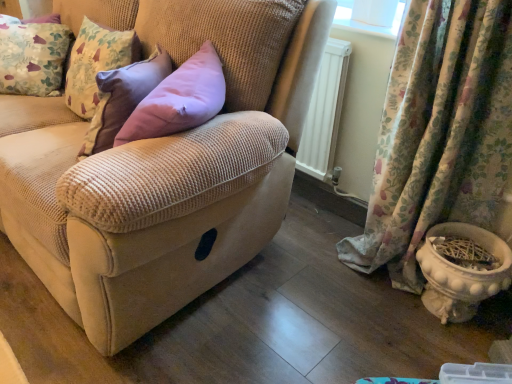
Question: From the image's perspective, is floral fabric cushion at upper left over white glossy flowerpot at lower right?

Choices:
 (A) yes
 (B) no

Answer: (A)

Question: Can we say floral fabric cushion at upper left lies outside white glossy flowerpot at lower right?

Choices:
 (A) yes
 (B) no

Answer: (A)

Question: Is floral fabric cushion at upper left at the left side of white glossy flowerpot at lower right?

Choices:
 (A) yes
 (B) no

Answer: (A)

Question: Considering the relative positions of floral fabric cushion at upper left and white glossy flowerpot at lower right in the image provided, is floral fabric cushion at upper left to the right of white glossy flowerpot at lower right from the viewer's perspective?

Choices:
 (A) no
 (B) yes

Answer: (A)

Question: Does floral fabric cushion at upper left have a larger size compared to white glossy flowerpot at lower right?

Choices:
 (A) no
 (B) yes

Answer: (B)

Question: Choose the correct answer: Is beige corduroy couch at center inside white glossy flowerpot at lower right or outside it?

Choices:
 (A) inside
 (B) outside

Answer: (B)

Question: Is beige corduroy couch at center bigger or smaller than white glossy flowerpot at lower right?

Choices:
 (A) small
 (B) big

Answer: (B)

Question: In the image, is beige corduroy couch at center on the left side or the right side of white glossy flowerpot at lower right?

Choices:
 (A) left
 (B) right

Answer: (A)

Question: Is beige corduroy couch at center in front of or behind white glossy flowerpot at lower right in the image?

Choices:
 (A) front
 (B) behind

Answer: (A)

Question: Is beige corduroy couch at center inside the boundaries of floral fabric curtain at lower right, or outside?

Choices:
 (A) outside
 (B) inside

Answer: (A)

Question: Relative to floral fabric curtain at lower right, is beige corduroy couch at center in front or behind?

Choices:
 (A) behind
 (B) front

Answer: (B)

Question: From the image's perspective, is beige corduroy couch at center positioned above or below floral fabric curtain at lower right?

Choices:
 (A) above
 (B) below

Answer: (A)

Question: In terms of width, does beige corduroy couch at center look wider or thinner when compared to floral fabric curtain at lower right?

Choices:
 (A) thin
 (B) wide

Answer: (B)

Question: From the image's perspective, is white glossy flowerpot at lower right located above or below beige corduroy couch at center?

Choices:
 (A) above
 (B) below

Answer: (B)

Question: Based on their sizes in the image, would you say white glossy flowerpot at lower right is bigger or smaller than beige corduroy couch at center?

Choices:
 (A) big
 (B) small

Answer: (B)